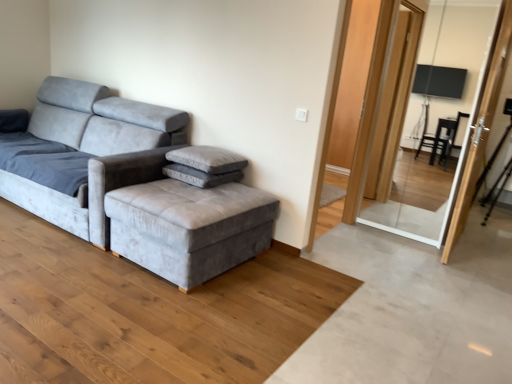
Where is `matte black screen door at upper right, which is counted as the second screen door, starting from the left`? matte black screen door at upper right, which is counted as the second screen door, starting from the left is located at coordinates (481, 127).

What do you see at coordinates (207, 159) in the screenshot? I see `gray velvety pillow at center` at bounding box center [207, 159].

What do you see at coordinates (200, 176) in the screenshot? I see `gray fabric footrest at center` at bounding box center [200, 176].

Measure the distance between transparent glass screen door at upper right, the first screen door when ordered from left to right, and camera.

transparent glass screen door at upper right, the first screen door when ordered from left to right, and camera are 5.83 meters apart.

The height and width of the screenshot is (384, 512). I want to click on transparent glass screen door at upper right, the first screen door when ordered from left to right, so click(x=439, y=119).

What do you see at coordinates (129, 184) in the screenshot? I see `velvet gray couch at left` at bounding box center [129, 184].

Locate an element on the screen. The image size is (512, 384). velvet grey ottoman at center is located at coordinates (189, 227).

Considering the relative sizes of velvet grey ottoman at center and transparent glass screen door at upper right, the second screen door from the right, in the image provided, is velvet grey ottoman at center bigger than transparent glass screen door at upper right, the second screen door from the right,?

No.

Could you tell me if velvet grey ottoman at center is facing transparent glass screen door at upper right, the second screen door from the right?

No, velvet grey ottoman at center is not turned towards transparent glass screen door at upper right, the second screen door from the right.

Is velvet grey ottoman at center directly adjacent to transparent glass screen door at upper right, the first screen door when ordered from left to right?

velvet grey ottoman at center and transparent glass screen door at upper right, the first screen door when ordered from left to right, are clearly separated.

Between velvet grey ottoman at center and transparent glass screen door at upper right, the second screen door from the right, which one has less height?

With less height is velvet grey ottoman at center.

Would you say transparent glass screen door at upper right, the first screen door when ordered from left to right, is to the left or to the right of matte black screen door at upper right, the 1th screen door viewed from the right, in the picture?

Based on their positions, transparent glass screen door at upper right, the first screen door when ordered from left to right, is located to the left of matte black screen door at upper right, the 1th screen door viewed from the right.

Considering the positions of objects transparent glass screen door at upper right, the second screen door from the right, and matte black screen door at upper right, which is counted as the second screen door, starting from the left, in the image provided, who is in front, transparent glass screen door at upper right, the second screen door from the right, or matte black screen door at upper right, which is counted as the second screen door, starting from the left,?

matte black screen door at upper right, which is counted as the second screen door, starting from the left, is more forward.

Is transparent glass screen door at upper right, the second screen door from the right, directly adjacent to matte black screen door at upper right, which is counted as the second screen door, starting from the left?

transparent glass screen door at upper right, the second screen door from the right, and matte black screen door at upper right, which is counted as the second screen door, starting from the left, are not in contact.

Between transparent glass screen door at upper right, the second screen door from the right, and matte black screen door at upper right, the 1th screen door viewed from the right, which one has larger size?

transparent glass screen door at upper right, the second screen door from the right, is bigger.

Is transparent glass screen door at upper right, the second screen door from the right, bigger or smaller than gray velvety pillow at center?

Considering their sizes, transparent glass screen door at upper right, the second screen door from the right, takes up more space than gray velvety pillow at center.

Does transparent glass screen door at upper right, the first screen door when ordered from left to right, appear on the left side of gray velvety pillow at center?

No, transparent glass screen door at upper right, the first screen door when ordered from left to right, is not to the left of gray velvety pillow at center.

Is transparent glass screen door at upper right, the first screen door when ordered from left to right, turned away from gray velvety pillow at center?

No, transparent glass screen door at upper right, the first screen door when ordered from left to right, is not facing the opposite direction of gray velvety pillow at center.

Is velvet gray couch at left oriented towards gray velvety pillow at center?

No.

From the image's perspective, which one is positioned lower, velvet gray couch at left or gray velvety pillow at center?

From the image's view, gray velvety pillow at center is below.

From a real-world perspective, is velvet gray couch at left on top of gray velvety pillow at center?

No, from a real-world perspective, velvet gray couch at left is not over gray velvety pillow at center

Between matte black screen door at upper right, which is counted as the second screen door, starting from the left, and transparent glass screen door at upper right, the second screen door from the right, which one appears on the right side from the viewer's perspective?

From the viewer's perspective, matte black screen door at upper right, which is counted as the second screen door, starting from the left, appears more on the right side.

Is matte black screen door at upper right, the 1th screen door viewed from the right, facing towards transparent glass screen door at upper right, the second screen door from the right?

Yes, matte black screen door at upper right, the 1th screen door viewed from the right, is oriented towards transparent glass screen door at upper right, the second screen door from the right.

Is matte black screen door at upper right, which is counted as the second screen door, starting from the left, not close to transparent glass screen door at upper right, the second screen door from the right?

Absolutely, matte black screen door at upper right, which is counted as the second screen door, starting from the left, is distant from transparent glass screen door at upper right, the second screen door from the right.

Between matte black screen door at upper right, the 1th screen door viewed from the right, and transparent glass screen door at upper right, the second screen door from the right, which one has larger width?

transparent glass screen door at upper right, the second screen door from the right, is wider.

Locate an element on the screen. The height and width of the screenshot is (384, 512). the footrest located underneath the matte black screen door at upper right, which is counted as the second screen door, starting from the left (from a real-world perspective) is located at coordinates (200, 176).

Considering the relative sizes of gray fabric footrest at center and matte black screen door at upper right, which is counted as the second screen door, starting from the left, in the image provided, is gray fabric footrest at center smaller than matte black screen door at upper right, which is counted as the second screen door, starting from the left,?

Yes, gray fabric footrest at center is smaller than matte black screen door at upper right, which is counted as the second screen door, starting from the left.

Could you measure the distance between gray fabric footrest at center and matte black screen door at upper right, the 1th screen door viewed from the right?

gray fabric footrest at center and matte black screen door at upper right, the 1th screen door viewed from the right, are 6.40 feet apart.

Can you confirm if gray fabric footrest at center is taller than matte black screen door at upper right, which is counted as the second screen door, starting from the left?

In fact, gray fabric footrest at center may be shorter than matte black screen door at upper right, which is counted as the second screen door, starting from the left.

Is gray velvety pillow at center further to camera compared to velvet gray couch at left?

Yes, gray velvety pillow at center is further from the camera.

The height and width of the screenshot is (384, 512). I want to click on pillow located above the velvet gray couch at left (from a real-world perspective), so click(207, 159).

Considering the relative positions of gray velvety pillow at center and velvet gray couch at left in the image provided, is gray velvety pillow at center to the right of velvet gray couch at left from the viewer's perspective?

Answer: Yes, gray velvety pillow at center is to the right of velvet gray couch at left.

Based on the photo, does gray velvety pillow at center have a lesser width compared to velvet gray couch at left?

Yes, gray velvety pillow at center is thinner than velvet gray couch at left.

This screenshot has height=384, width=512. Identify the location of stool located on the left of transparent glass screen door at upper right, the second screen door from the right. (189, 227).

What are the coordinates of `screen door in front of the transparent glass screen door at upper right, the first screen door when ordered from left to right` in the screenshot? It's located at (481, 127).

Looking at the image, which one is located further to velvet gray couch at left, gray velvety pillow at center or gray fabric footrest at center?

gray velvety pillow at center is positioned further to the anchor velvet gray couch at left.

When comparing their distances from transparent glass screen door at upper right, the second screen door from the right, does velvet grey ottoman at center or matte black screen door at upper right, the 1th screen door viewed from the right, seem closer?

The object closer to transparent glass screen door at upper right, the second screen door from the right, is matte black screen door at upper right, the 1th screen door viewed from the right.

Considering their positions, is gray fabric footrest at center positioned closer to transparent glass screen door at upper right, the second screen door from the right, than velvet gray couch at left?

gray fabric footrest at center.

Based on their spatial positions, is gray fabric footrest at center or matte black screen door at upper right, which is counted as the second screen door, starting from the left, closer to velvet grey ottoman at center?

Based on the image, gray fabric footrest at center appears to be nearer to velvet grey ottoman at center.

Which object lies nearer to the anchor point matte black screen door at upper right, which is counted as the second screen door, starting from the left, velvet grey ottoman at center or gray velvety pillow at center?

Based on the image, gray velvety pillow at center appears to be nearer to matte black screen door at upper right, which is counted as the second screen door, starting from the left.

Looking at the image, which one is located closer to velvet grey ottoman at center, gray fabric footrest at center or transparent glass screen door at upper right, the first screen door when ordered from left to right?

The object closer to velvet grey ottoman at center is gray fabric footrest at center.

Which object lies nearer to the anchor point transparent glass screen door at upper right, the second screen door from the right, velvet gray couch at left or matte black screen door at upper right, the 1th screen door viewed from the right?

Based on the image, matte black screen door at upper right, the 1th screen door viewed from the right, appears to be nearer to transparent glass screen door at upper right, the second screen door from the right.

Which object lies nearer to the anchor point velvet gray couch at left, matte black screen door at upper right, the 1th screen door viewed from the right, or gray fabric footrest at center?

The object closer to velvet gray couch at left is gray fabric footrest at center.

The image size is (512, 384). Identify the location of footrest between velvet grey ottoman at center and transparent glass screen door at upper right, the second screen door from the right, in the horizontal direction. 200,176.

At what (x,y) coordinates should I click in order to perform the action: click on footrest between velvet gray couch at left and matte black screen door at upper right, which is counted as the second screen door, starting from the left, in the horizontal direction. Please return your answer as a coordinate pair (x, y). Looking at the image, I should click on (200, 176).

Image resolution: width=512 pixels, height=384 pixels. Identify the location of pillow between velvet grey ottoman at center and matte black screen door at upper right, the 1th screen door viewed from the right, in the horizontal direction. (207, 159).

At what (x,y) coordinates should I click in order to perform the action: click on pillow situated between velvet grey ottoman at center and transparent glass screen door at upper right, the second screen door from the right, from left to right. Please return your answer as a coordinate pair (x, y). The height and width of the screenshot is (384, 512). Looking at the image, I should click on (207, 159).